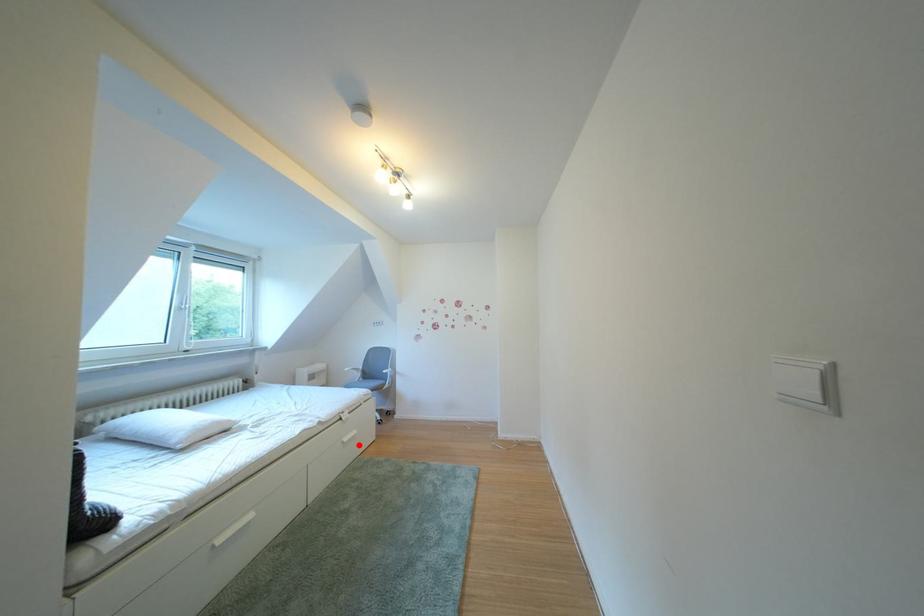
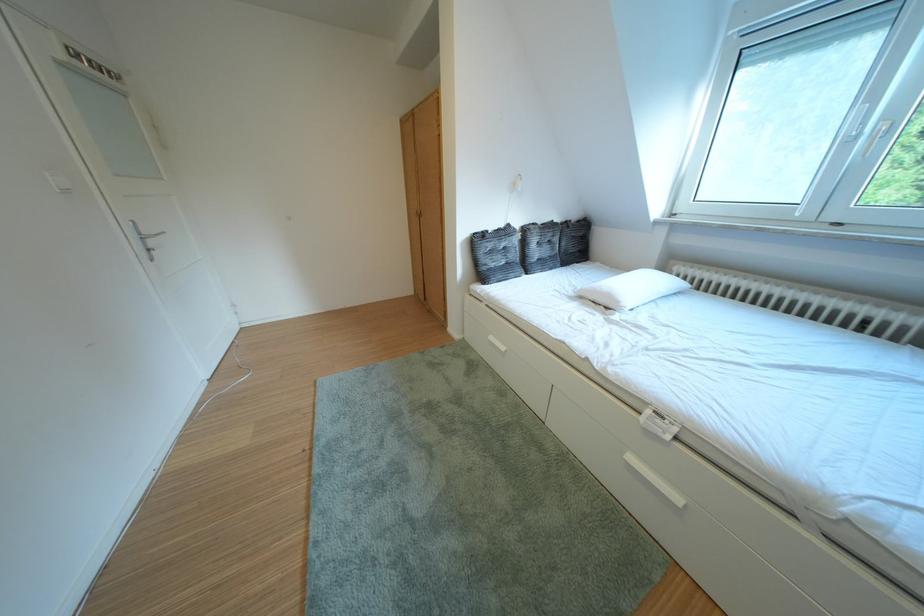
The point at the highlighted location is marked in the first image. Where is the corresponding point in the second image?

(646, 464)